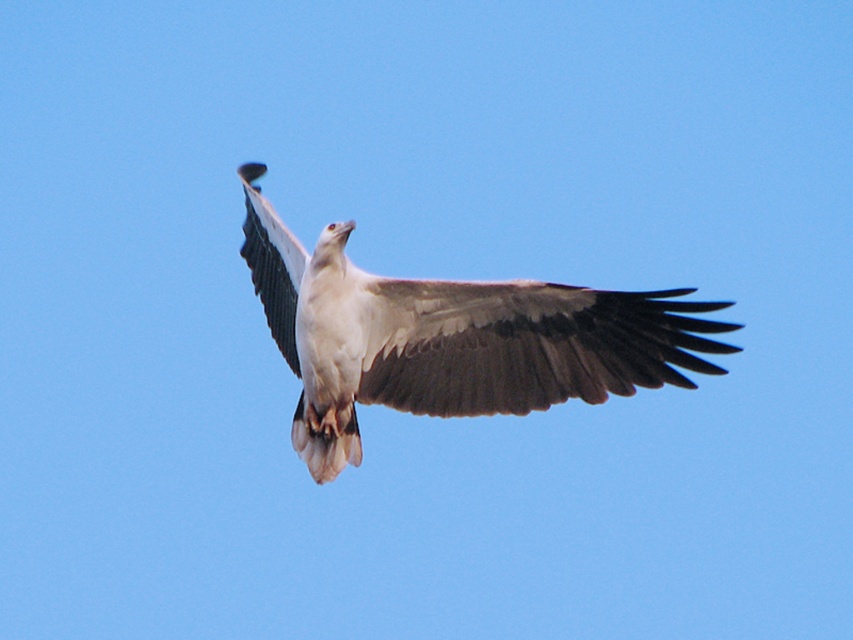
Between white feathered eagle at center and brown feathered wing at center, which one has more height?

Standing taller between the two is brown feathered wing at center.

Who is more forward, [548,356] or [549,356]?

Point [549,356] is in front.

Where is `white feathered eagle at center`? The height and width of the screenshot is (640, 853). white feathered eagle at center is located at coordinates (450, 339).

Is point (329, 362) positioned after point (263, 234)?

No, it is not.

Is white feathered eagle at center above white feathered wing at center?

No.

Is point (666, 314) in front of point (274, 275)?

Yes, point (666, 314) is closer to viewer.

I want to click on white feathered eagle at center, so click(450, 339).

Can you confirm if brown feathered wing at center is bigger than white feathered wing at center?

Actually, brown feathered wing at center might be smaller than white feathered wing at center.

Which of these two, brown feathered wing at center or white feathered wing at center, stands taller?

white feathered wing at center is taller.

Which is behind, point (650, 298) or point (268, 323)?

Positioned behind is point (268, 323).

In order to click on brown feathered wing at center in this screenshot , I will do `click(526, 344)`.